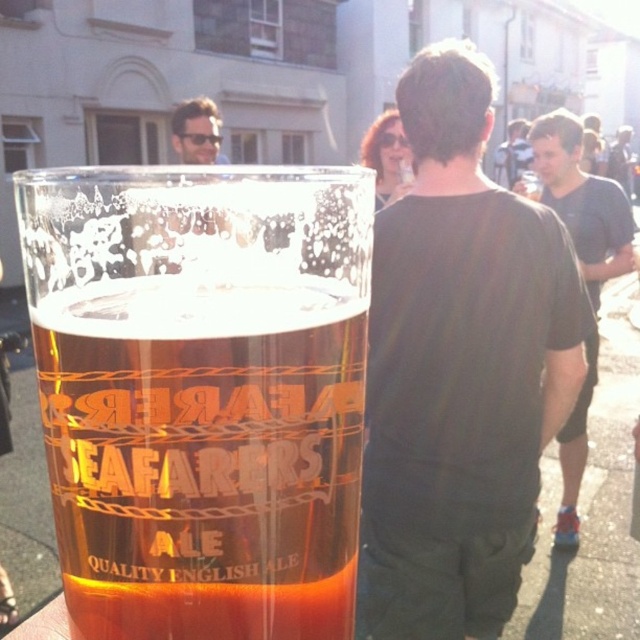
Does dark gray t-shirt at center have a greater width compared to dark brown leather jacket at upper center?

Yes, dark gray t-shirt at center is wider than dark brown leather jacket at upper center.

Is point (577, 528) positioned before point (525, 144)?

Yes, it is in front of point (525, 144).

Find the location of a particular element. dark gray t-shirt at center is located at coordinates (580, 269).

Who is higher up, black matte shirt at center or dark brown leather jacket at upper center?

dark brown leather jacket at upper center

Does black matte shirt at center appear over dark brown leather jacket at upper center?

Actually, black matte shirt at center is below dark brown leather jacket at upper center.

Is point (500, 432) behind point (497, 150)?

No, (500, 432) is in front of (497, 150).

Where is `black matte shirt at center`? This screenshot has height=640, width=640. black matte shirt at center is located at coordinates point(460,368).

The image size is (640, 640). Describe the element at coordinates (460, 368) in the screenshot. I see `black matte shirt at center` at that location.

Is black matte shirt at center wider than dark gray t-shirt at center?

Incorrect, black matte shirt at center's width does not surpass dark gray t-shirt at center's.

Describe the element at coordinates (460, 368) in the screenshot. I see `black matte shirt at center` at that location.

You are a GUI agent. You are given a task and a screenshot of the screen. Output one action in this format:
    pyautogui.click(x=<x>, y=<y>)
    Task: Click on the black matte shirt at center
    The width and height of the screenshot is (640, 640).
    Given the screenshot: What is the action you would take?
    pyautogui.click(x=460, y=368)